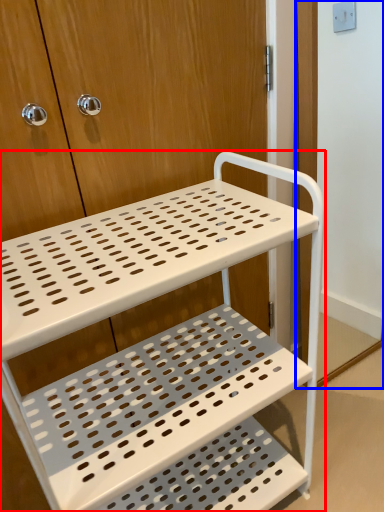
Question: Which point is closer to the camera, furniture (highlighted by a red box) or screen door (highlighted by a blue box)?

Choices:
 (A) furniture
 (B) screen door

Answer: (A)